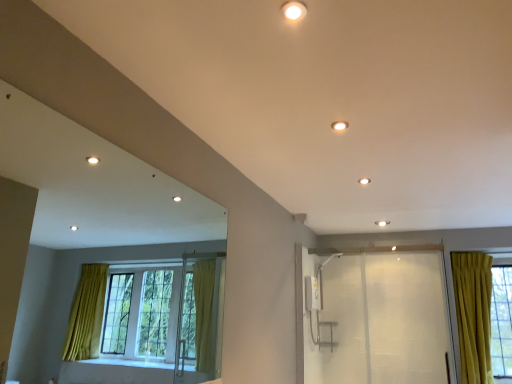
Question: Does matte white light fixture at upper center, placed as the 1th lighting when sorted from left to right, have a lesser height compared to transparent plastic screen door at right?

Choices:
 (A) yes
 (B) no

Answer: (A)

Question: From a real-world perspective, does matte white light fixture at upper center, placed as the 1th lighting when sorted from left to right, sit lower than transparent plastic screen door at right?

Choices:
 (A) no
 (B) yes

Answer: (A)

Question: Is matte white light fixture at upper center, placed as the second lighting when sorted from back to front, completely or partially outside of transparent plastic screen door at right?

Choices:
 (A) no
 (B) yes

Answer: (B)

Question: From a real-world perspective, is matte white light fixture at upper center, placed as the second lighting when sorted from back to front, on transparent plastic screen door at right?

Choices:
 (A) no
 (B) yes

Answer: (B)

Question: Is matte white light fixture at upper center, which is counted as the 2th lighting, starting from the right, thinner than transparent plastic screen door at right?

Choices:
 (A) yes
 (B) no

Answer: (B)

Question: From the image's perspective, does matte white light fixture at upper center, placed as the second lighting when sorted from back to front, appear higher than transparent plastic screen door at right?

Choices:
 (A) yes
 (B) no

Answer: (A)

Question: Is matte white light fixture at upper center, the 1th lighting when ordered from front to back, aimed at matte white light fixture at upper center, marked as the 2th lighting in a left-to-right arrangement?

Choices:
 (A) yes
 (B) no

Answer: (A)

Question: Is matte white light fixture at upper center, which is counted as the 2th lighting, starting from the right, outside of matte white light fixture at upper center, which appears as the 1th lighting when ordered from the bottom?

Choices:
 (A) yes
 (B) no

Answer: (A)

Question: From a real-world perspective, is matte white light fixture at upper center, the 1th lighting when ordered from front to back, under matte white light fixture at upper center, which is counted as the 2th lighting, starting from the front?

Choices:
 (A) yes
 (B) no

Answer: (A)

Question: Can you confirm if matte white light fixture at upper center, which is counted as the 2th lighting, starting from the right, is positioned to the right of matte white light fixture at upper center, which is the first lighting from back to front?

Choices:
 (A) yes
 (B) no

Answer: (B)

Question: Considering the relative positions of matte white light fixture at upper center, placed as the second lighting when sorted from back to front, and matte white light fixture at upper center, marked as the 2th lighting in a left-to-right arrangement, in the image provided, is matte white light fixture at upper center, placed as the second lighting when sorted from back to front, in front of matte white light fixture at upper center, marked as the 2th lighting in a left-to-right arrangement,?

Choices:
 (A) yes
 (B) no

Answer: (A)

Question: Considering the relative sizes of matte white light fixture at upper center, placed as the second lighting when sorted from back to front, and matte white light fixture at upper center, the second lighting in the top-to-bottom sequence, in the image provided, is matte white light fixture at upper center, placed as the second lighting when sorted from back to front, shorter than matte white light fixture at upper center, the second lighting in the top-to-bottom sequence,?

Choices:
 (A) no
 (B) yes

Answer: (B)

Question: Is matte white light fixture at upper center, which appears as the 1th lighting when ordered from the bottom, thinner than transparent plastic screen door at right?

Choices:
 (A) yes
 (B) no

Answer: (B)